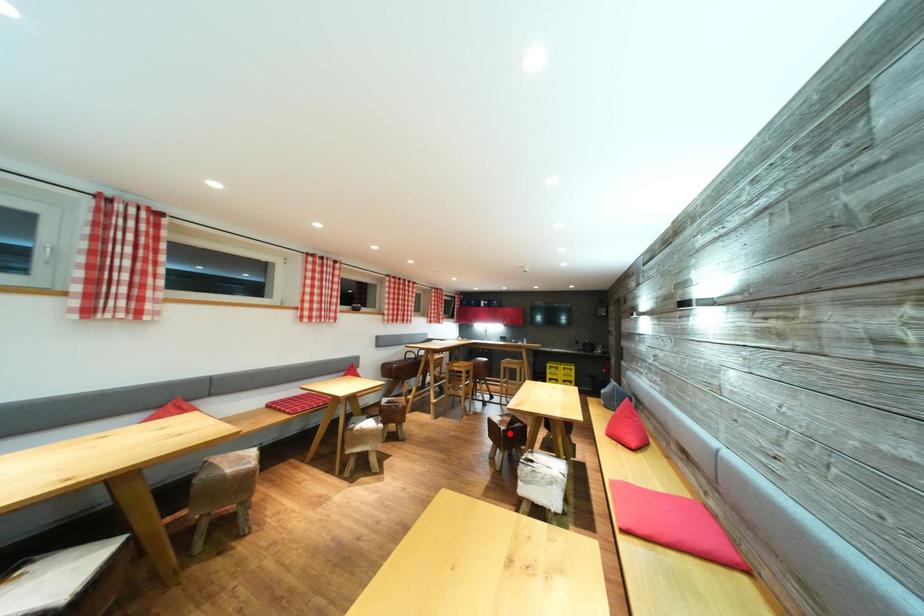
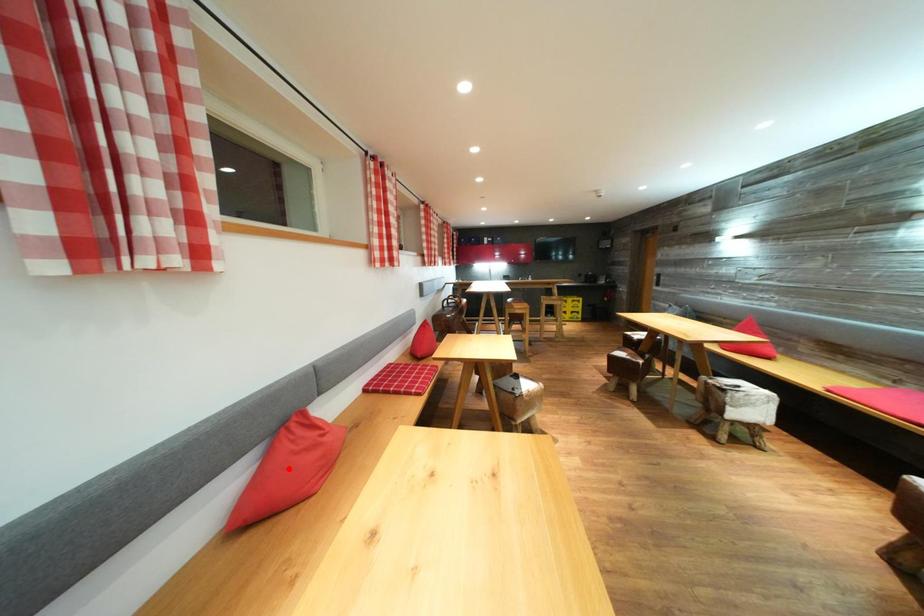
I am providing you with two images of the same scene from different viewpoints. A red point is marked on the first image and another point is marked on the second image. Does the point marked in image1 correspond to the same location as the one in image2?

No